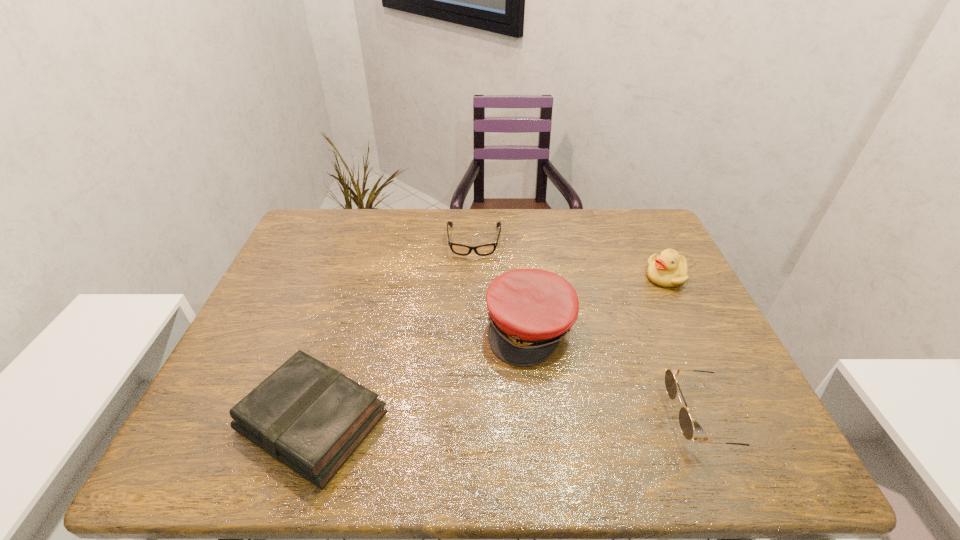
This screenshot has height=540, width=960. Find the location of `object that is at the far edge`. object that is at the far edge is located at coordinates (482, 250).

The width and height of the screenshot is (960, 540). Identify the location of book present at the near edge. (307, 415).

This screenshot has width=960, height=540. Identify the location of sunglasses positioned at the near edge. (685, 421).

At what (x,y) coordinates should I click in order to perform the action: click on object that is at the left edge. Please return your answer as a coordinate pair (x, y). This screenshot has width=960, height=540. Looking at the image, I should click on (307, 415).

At what (x,y) coordinates should I click in order to perform the action: click on sunglasses present at the right edge. Please return your answer as a coordinate pair (x, y). The image size is (960, 540). Looking at the image, I should click on (685, 421).

Where is `duckling that is at the right edge`? The width and height of the screenshot is (960, 540). duckling that is at the right edge is located at coordinates (668, 269).

In order to click on object that is at the near left corner in this screenshot , I will do `click(307, 415)`.

Where is `object that is at the near right corner`? object that is at the near right corner is located at coordinates (685, 421).

The width and height of the screenshot is (960, 540). What are the coordinates of `vacant space at the far edge of the desktop` in the screenshot? It's located at (588, 209).

Find the location of a particular element. Image resolution: width=960 pixels, height=540 pixels. vacant space at the near edge of the desktop is located at coordinates (490, 404).